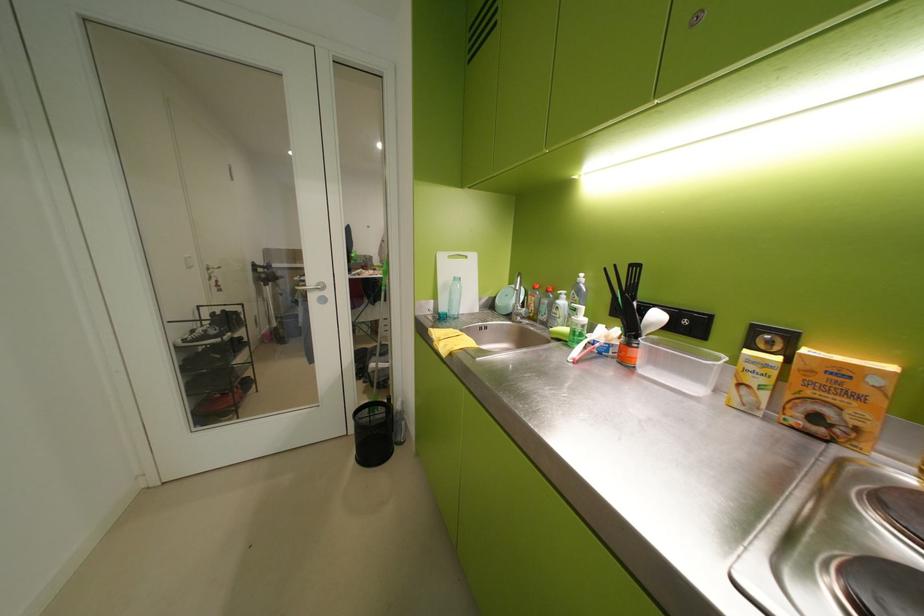
The image size is (924, 616). Find the location of `black light switch`. black light switch is located at coordinates (683, 321).